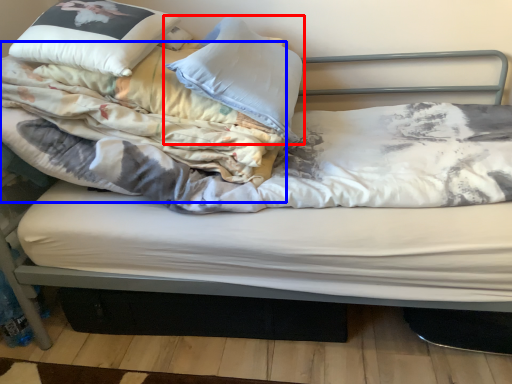
Question: Which point is further to the camera, pillow (highlighted by a red box) or blanket (highlighted by a blue box)?

Choices:
 (A) pillow
 (B) blanket

Answer: (A)